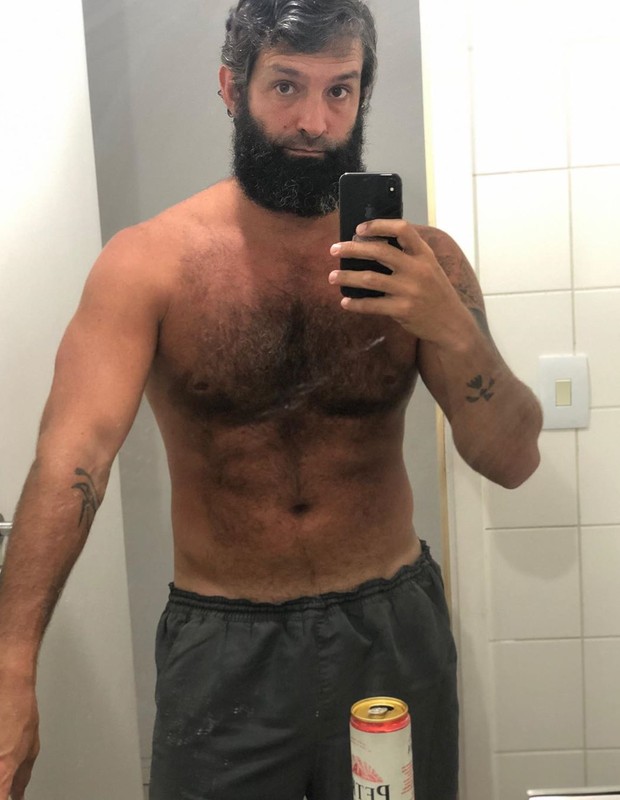
This screenshot has width=620, height=800. Identify the location of light switch. (570, 382).